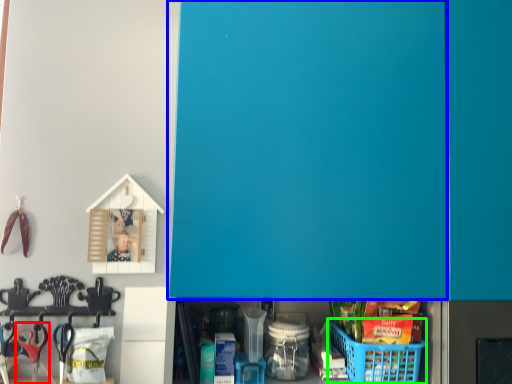
Question: Which is farther away from scissors (highlighted by a red box)? door (highlighted by a blue box) or basket (highlighted by a green box)?

Choices:
 (A) door
 (B) basket

Answer: (A)